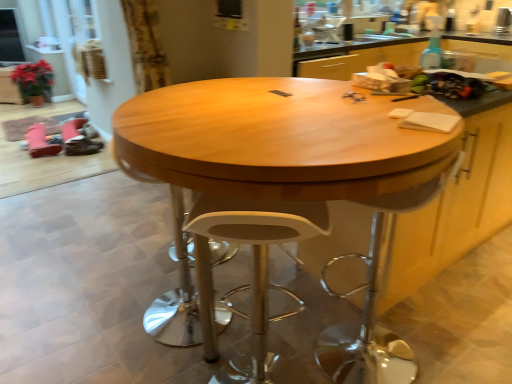
Question: Considering the relative sizes of white plastic stool at center and white plastic swivel chair at center in the image provided, is white plastic stool at center wider than white plastic swivel chair at center?

Choices:
 (A) yes
 (B) no

Answer: (B)

Question: Is white plastic stool at center positioned beyond the bounds of white plastic swivel chair at center?

Choices:
 (A) no
 (B) yes

Answer: (B)

Question: Is white plastic stool at center smaller than white plastic swivel chair at center?

Choices:
 (A) yes
 (B) no

Answer: (A)

Question: From the image's perspective, is white plastic stool at center above white plastic swivel chair at center?

Choices:
 (A) no
 (B) yes

Answer: (A)

Question: Considering the relative sizes of white plastic stool at center and white plastic swivel chair at center in the image provided, is white plastic stool at center bigger than white plastic swivel chair at center?

Choices:
 (A) no
 (B) yes

Answer: (A)

Question: Is white plastic stool at center far from white plastic swivel chair at center?

Choices:
 (A) yes
 (B) no

Answer: (B)

Question: Can you confirm if wooden table at center is positioned to the left of green matte plant at left, the second cabinetry positioned from the bottom?

Choices:
 (A) yes
 (B) no

Answer: (B)

Question: Considering the relative positions of wooden table at center and green matte plant at left, which ranks as the 1th cabinetry in back-to-front order, in the image provided, is wooden table at center in front of green matte plant at left, which ranks as the 1th cabinetry in back-to-front order,?

Choices:
 (A) no
 (B) yes

Answer: (B)

Question: Would you say green matte plant at left, the 1th cabinetry in the left-to-right sequence, is part of wooden table at center's contents?

Choices:
 (A) no
 (B) yes

Answer: (A)

Question: Is wooden table at center taller than green matte plant at left, the 1th cabinetry viewed from the top?

Choices:
 (A) yes
 (B) no

Answer: (A)

Question: Is wooden table at center completely or partially outside of green matte plant at left, the 1th cabinetry viewed from the top?

Choices:
 (A) no
 (B) yes

Answer: (B)

Question: Is wooden table at center thinner than green matte plant at left, marked as the second cabinetry in a right-to-left arrangement?

Choices:
 (A) yes
 (B) no

Answer: (B)

Question: Is wooden cabinet at center, positioned as the second cabinetry in left-to-right order, thinner than white plastic swivel chair at center?

Choices:
 (A) no
 (B) yes

Answer: (A)